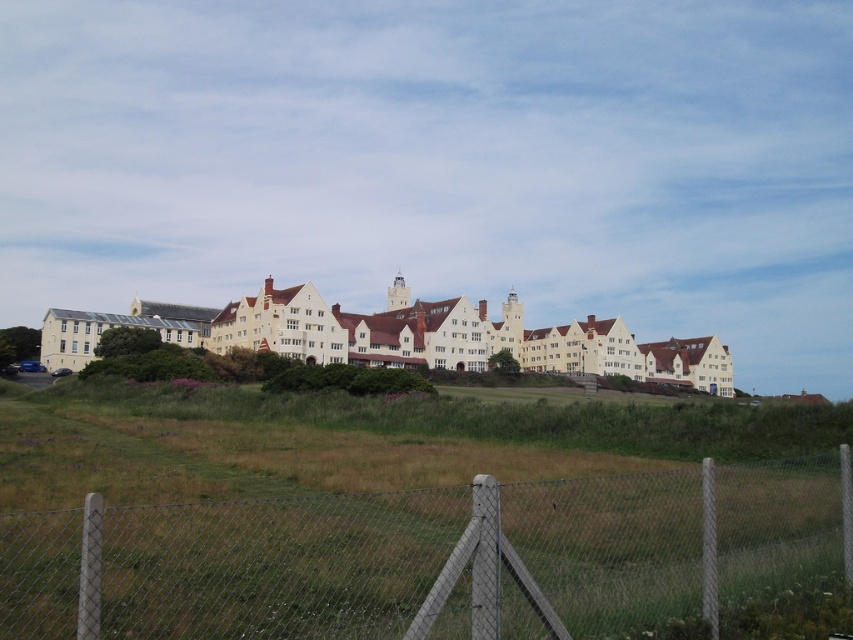
Question: Which of the following is the farthest from the observer?

Choices:
 (A) (132, 324)
 (B) (239, 532)

Answer: (A)

Question: Which of the following is the farthest from the observer?

Choices:
 (A) gray chain-link fence at center
 (B) white matte building at center

Answer: (B)

Question: Is gray chain-link fence at center further to the viewer compared to white matte building at center?

Choices:
 (A) yes
 (B) no

Answer: (B)

Question: Is gray chain-link fence at center positioned before white matte building at center?

Choices:
 (A) no
 (B) yes

Answer: (B)

Question: Is gray chain-link fence at center to the right of white matte building at center from the viewer's perspective?

Choices:
 (A) yes
 (B) no

Answer: (B)